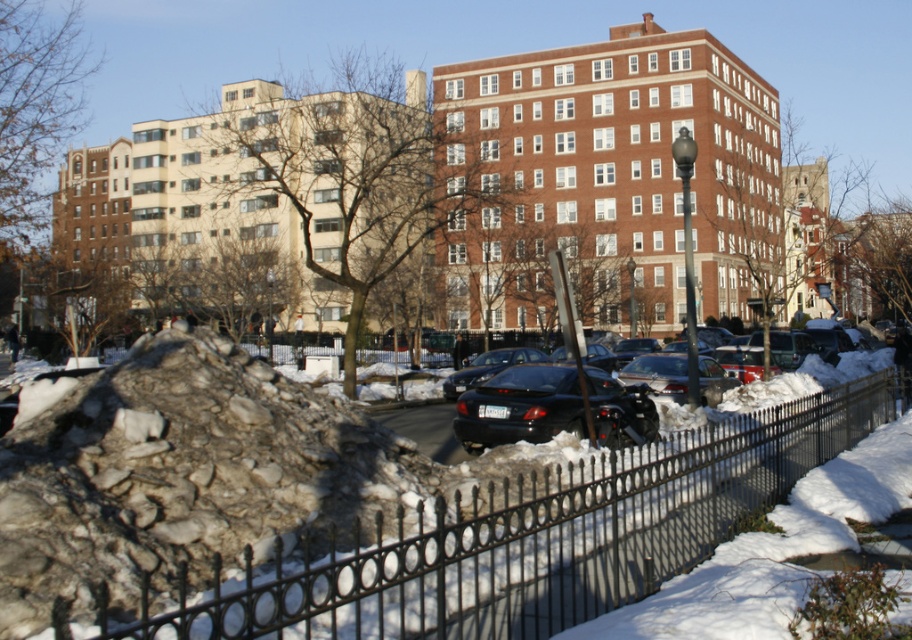
Question: Is white powdery snow at lower right to the right of shiny black sedan at center from the viewer's perspective?

Choices:
 (A) yes
 (B) no

Answer: (B)

Question: Is black matte car at center bigger than shiny black sedan at center?

Choices:
 (A) yes
 (B) no

Answer: (B)

Question: Which of the following is the farthest from the observer?

Choices:
 (A) shiny black sedan at center
 (B) rocky debris at lower left
 (C) black matte car at center

Answer: (A)

Question: Among these objects, which one is farthest from the camera?

Choices:
 (A) rocky debris at lower left
 (B) shiny black sedan at center

Answer: (B)

Question: Does black wrought iron fence at lower center appear under shiny black sedan at center?

Choices:
 (A) yes
 (B) no

Answer: (A)

Question: Which object is positioned farthest from the black matte car at center?

Choices:
 (A) rocky debris at lower left
 (B) black wrought iron fence at lower center

Answer: (A)